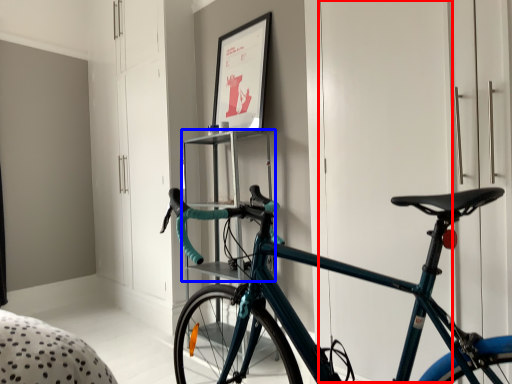
Question: Which object is further to the camera taking this photo, door (highlighted by a red box) or shelf (highlighted by a blue box)?

Choices:
 (A) door
 (B) shelf

Answer: (B)